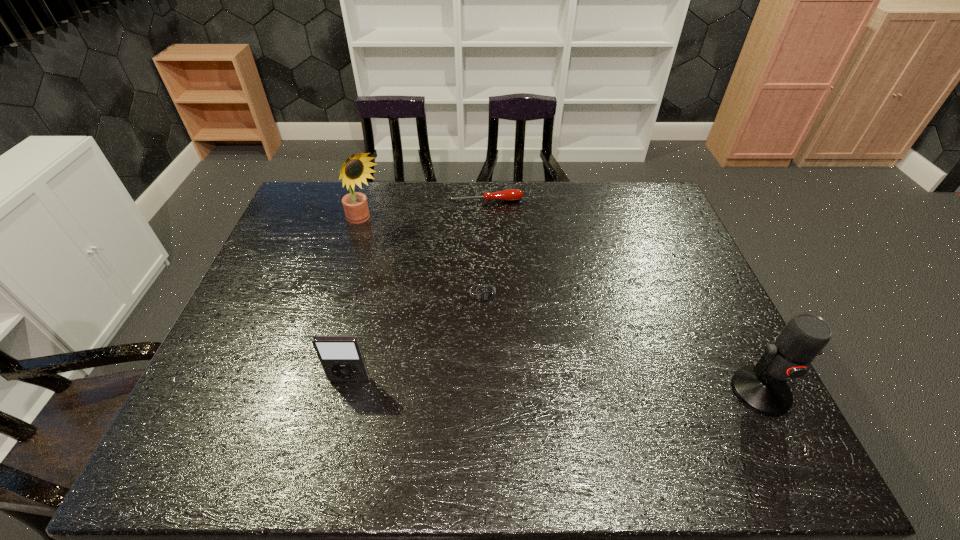
Identify which object is located as the second nearest to the farthest object. Please provide its 2D coordinates. Your answer should be formatted as a tuple, i.e. [(x, y)], where the tuple contains the x and y coordinates of a point satisfying the conditions above.

[(485, 294)]

Where is `free location that satisfies the following two spatial constraints: 1. on the back side of the second farthest object; 2. on the right side of the farthest object`? The image size is (960, 540). free location that satisfies the following two spatial constraints: 1. on the back side of the second farthest object; 2. on the right side of the farthest object is located at coordinates (372, 200).